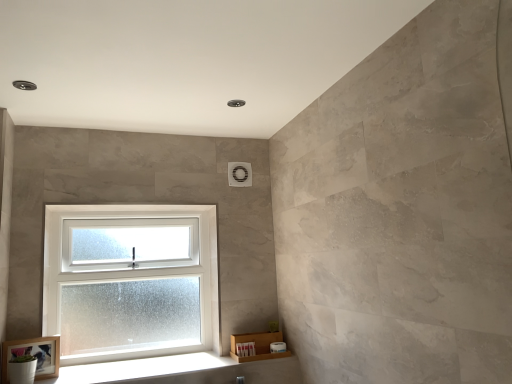
Question: Does white frosted glass window at lower left have a larger size compared to white wood at lower left?

Choices:
 (A) yes
 (B) no

Answer: (A)

Question: From a real-world perspective, is white frosted glass window at lower left physically above white wood at lower left?

Choices:
 (A) no
 (B) yes

Answer: (B)

Question: From the image's perspective, does white frosted glass window at lower left appear lower than white wood at lower left?

Choices:
 (A) no
 (B) yes

Answer: (A)

Question: Is white frosted glass window at lower left positioned behind white wood at lower left?

Choices:
 (A) no
 (B) yes

Answer: (B)

Question: Is white frosted glass window at lower left oriented towards white wood at lower left?

Choices:
 (A) yes
 (B) no

Answer: (A)

Question: In the image, is white frosted glass window at lower left positioned in front of or behind white wood at lower left?

Choices:
 (A) behind
 (B) front

Answer: (A)

Question: Is point (114, 235) closer or farther from the camera than point (96, 375)?

Choices:
 (A) farther
 (B) closer

Answer: (A)

Question: Visually, is white frosted glass window at lower left positioned to the left or to the right of white wood at lower left?

Choices:
 (A) right
 (B) left

Answer: (B)

Question: From a real-world perspective, relative to white wood at lower left, is white frosted glass window at lower left vertically above or below?

Choices:
 (A) below
 (B) above

Answer: (B)

Question: Visually, is white frosted glass window at lower left positioned to the left or to the right of wooden frame at lower left?

Choices:
 (A) left
 (B) right

Answer: (B)

Question: Relative to wooden frame at lower left, is white frosted glass window at lower left in front or behind?

Choices:
 (A) front
 (B) behind

Answer: (B)

Question: Looking at their shapes, would you say white frosted glass window at lower left is wider or thinner than wooden frame at lower left?

Choices:
 (A) thin
 (B) wide

Answer: (B)

Question: From the image's perspective, is white frosted glass window at lower left positioned above or below wooden frame at lower left?

Choices:
 (A) above
 (B) below

Answer: (A)

Question: Do you think wooden frame at lower left is within white frosted glass window at lower left, or outside of it?

Choices:
 (A) outside
 (B) inside

Answer: (A)

Question: Does point pos(8,355) appear closer or farther from the camera than point pos(167,352)?

Choices:
 (A) closer
 (B) farther

Answer: (A)